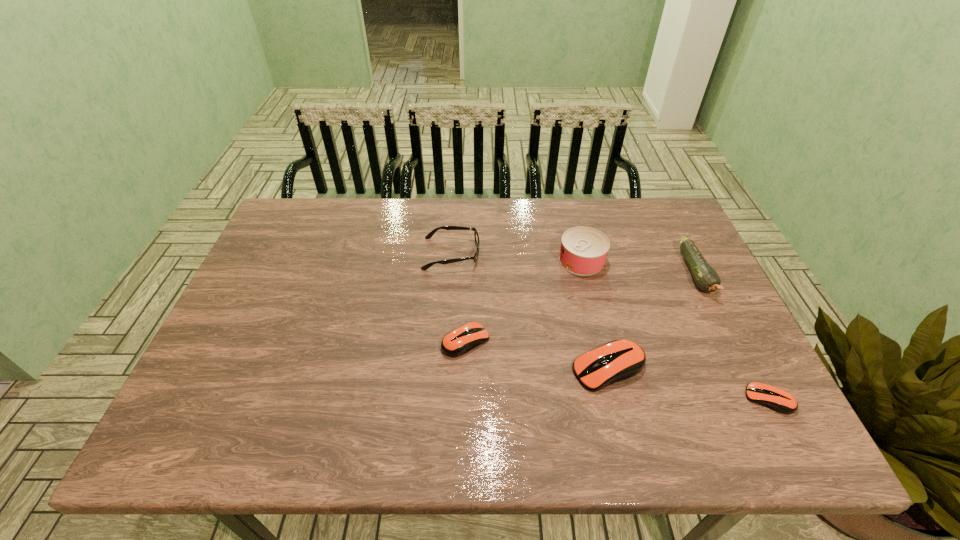
Please point a spot on the left to add another computer mouse. Please provide its 2D coordinates. Your answer should be formatted as a tuple, i.e. [(x, y)], where the tuple contains the x and y coordinates of a point satisfying the conditions above.

[(336, 316)]